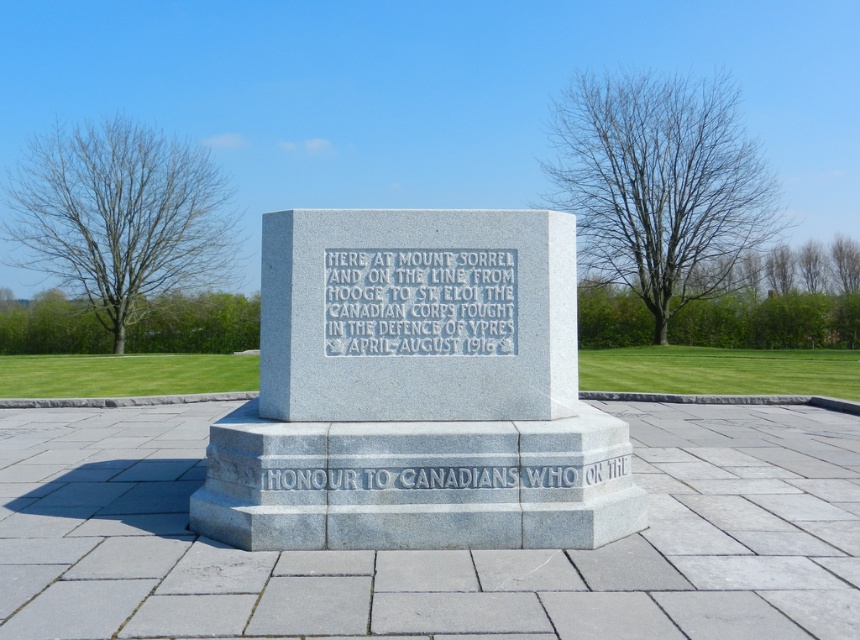
Question: Can you confirm if gray stone monument at center is positioned to the left of gray stone plaque at center?

Choices:
 (A) yes
 (B) no

Answer: (A)

Question: Does gray stone monument at center have a greater width compared to gray stone plaque at center?

Choices:
 (A) yes
 (B) no

Answer: (A)

Question: Is gray stone monument at center wider than gray stone plaque at center?

Choices:
 (A) no
 (B) yes

Answer: (B)

Question: Which point is farther to the camera?

Choices:
 (A) (545, 460)
 (B) (450, 323)

Answer: (B)

Question: Which point is farther to the camera?

Choices:
 (A) (243, 525)
 (B) (388, 282)

Answer: (B)

Question: Which object appears closest to the camera in this image?

Choices:
 (A) gray stone plaque at center
 (B) gray stone monument at center

Answer: (B)